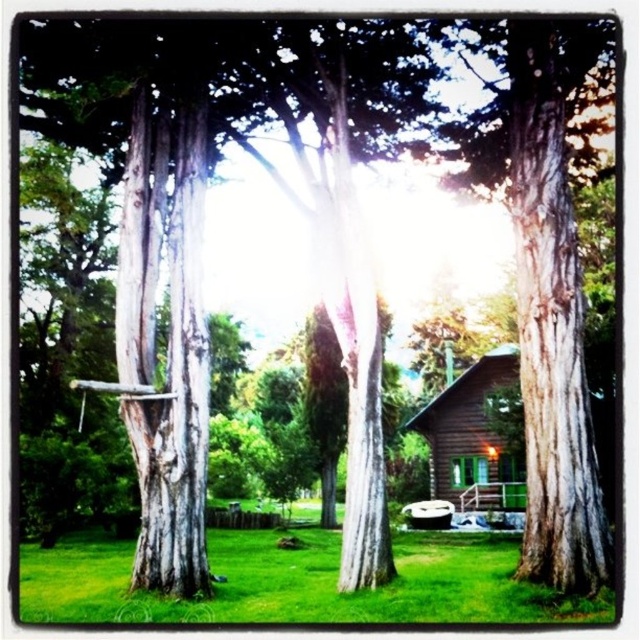
Between point (577, 605) and point (477, 506), which one is positioned in front?

Point (577, 605)

Between green grass at lower center and brown wooden cabin at center, which one appears on the left side from the viewer's perspective?

From the viewer's perspective, green grass at lower center appears more on the left side.

This screenshot has width=640, height=640. What are the coordinates of `green grass at lower center` in the screenshot? It's located at (300, 582).

The image size is (640, 640). What are the coordinates of `green grass at lower center` in the screenshot? It's located at (300, 582).

Which is behind, point (144, 493) or point (424, 428)?

The point (424, 428) is behind.

Does gray textured tree trunk at left have a greater height compared to brown wooden cabin at center?

Indeed, gray textured tree trunk at left has a greater height compared to brown wooden cabin at center.

Describe the element at coordinates (177, 394) in the screenshot. I see `gray textured tree trunk at left` at that location.

Identify the location of gray textured tree trunk at left. (177, 394).

Is point (417, 545) in front of point (173, 586)?

That is False.

Which is more to the left, green grass at lower center or gray textured tree trunk at left?

From the viewer's perspective, gray textured tree trunk at left appears more on the left side.

Find the location of a particular element. green grass at lower center is located at coordinates (300, 582).

This screenshot has width=640, height=640. I want to click on green grass at lower center, so click(x=300, y=582).